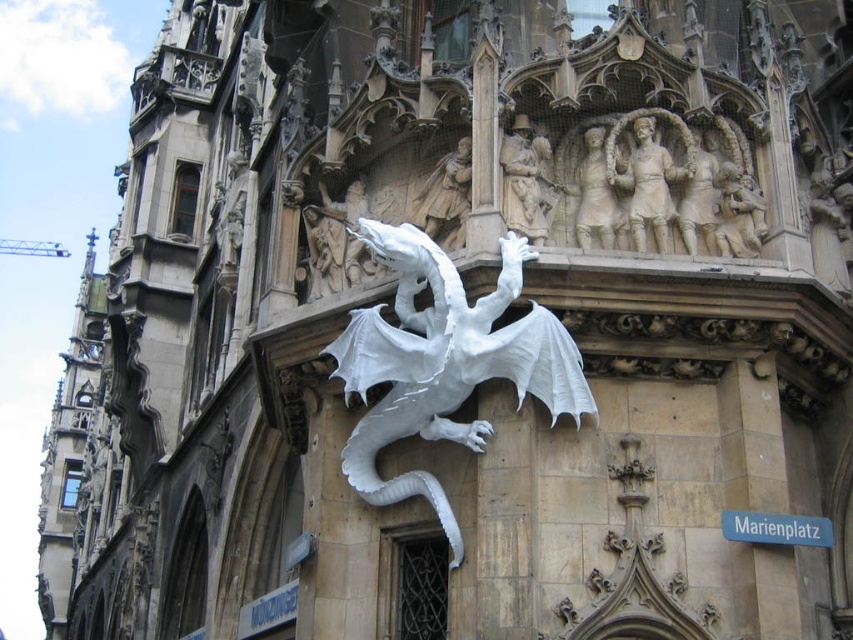
Question: Can you confirm if white stone relief figures at upper center is positioned to the left of blue plastic sign at lower right?

Choices:
 (A) yes
 (B) no

Answer: (A)

Question: Which point is closer to the camera?

Choices:
 (A) (631, 230)
 (B) (440, 435)
 (C) (457, 225)

Answer: (B)

Question: Which point appears farthest from the camera in this image?

Choices:
 (A) coord(730,520)
 (B) coord(360,317)

Answer: (B)

Question: Which of the following is the closest to the observer?

Choices:
 (A) blue plastic sign at lower right
 (B) white stone relief at upper center

Answer: (A)

Question: Is white stone relief figures at upper center closer to the viewer compared to white stone relief at upper center?

Choices:
 (A) no
 (B) yes

Answer: (B)

Question: Does white stone dragon at center come in front of white stone relief at upper center?

Choices:
 (A) no
 (B) yes

Answer: (B)